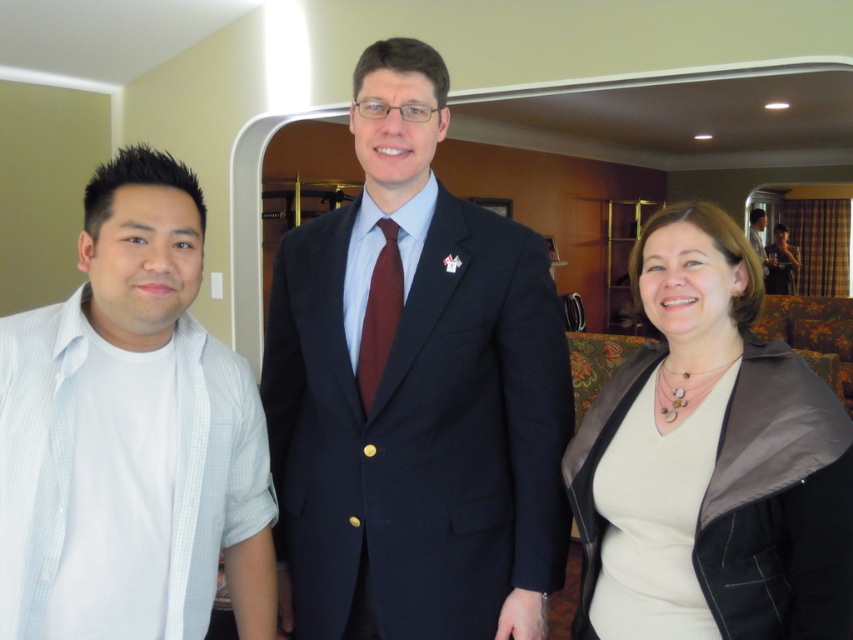
Can you confirm if white matte dress at center is thinner than dark blue suit at center?

Yes.

Is point (630, 593) less distant than point (759, 240)?

Yes, it is in front of point (759, 240).

Identify the location of white matte dress at center. (654, 518).

How much distance is there between white cotton shirt at left and dark blue suit at center?

The distance of white cotton shirt at left from dark blue suit at center is 7.92 meters.

Between white cotton shirt at left and dark blue suit at center, which one is positioned lower?

white cotton shirt at left

Is point (103, 198) closer to camera compared to point (759, 240)?

Yes, it is in front of point (759, 240).

Find the location of a particular element. This screenshot has height=640, width=853. white cotton shirt at left is located at coordinates (131, 433).

Does matte black jacket at lower right appear on the right side of white matte dress at center?

Correct, you'll find matte black jacket at lower right to the right of white matte dress at center.

Is point (608, 497) positioned before point (665, 570)?

No, (608, 497) is behind (665, 570).

Locate an element on the screen. Image resolution: width=853 pixels, height=640 pixels. matte black jacket at lower right is located at coordinates (711, 460).